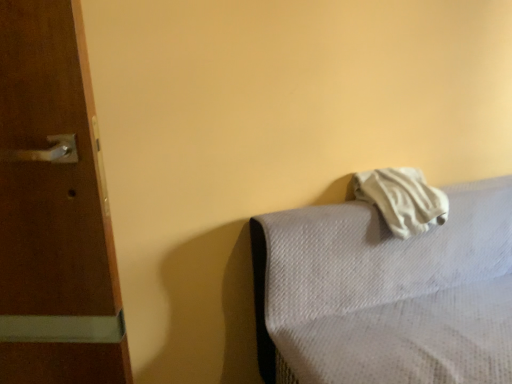
Question: Considering the relative sizes of white textured mattress at right and white soft towel at upper right in the image provided, is white textured mattress at right smaller than white soft towel at upper right?

Choices:
 (A) no
 (B) yes

Answer: (A)

Question: Is white textured mattress at right positioned with its back to white soft towel at upper right?

Choices:
 (A) no
 (B) yes

Answer: (B)

Question: Does white textured mattress at right have a greater width compared to white soft towel at upper right?

Choices:
 (A) no
 (B) yes

Answer: (B)

Question: Is white textured mattress at right surrounding white soft towel at upper right?

Choices:
 (A) no
 (B) yes

Answer: (B)

Question: From a real-world perspective, is white textured mattress at right under white soft towel at upper right?

Choices:
 (A) yes
 (B) no

Answer: (A)

Question: Does white textured mattress at right turn towards white soft towel at upper right?

Choices:
 (A) no
 (B) yes

Answer: (A)

Question: Would you say white soft towel at upper right is outside white textured mattress at right?

Choices:
 (A) no
 (B) yes

Answer: (A)

Question: Is white soft towel at upper right with white textured mattress at right?

Choices:
 (A) no
 (B) yes

Answer: (A)

Question: Considering the relative positions of white soft towel at upper right and white textured mattress at right in the image provided, is white soft towel at upper right in front of white textured mattress at right?

Choices:
 (A) no
 (B) yes

Answer: (A)

Question: Can you confirm if white soft towel at upper right is bigger than white textured mattress at right?

Choices:
 (A) no
 (B) yes

Answer: (A)

Question: Could white textured mattress at right be considered to be inside white soft towel at upper right?

Choices:
 (A) yes
 (B) no

Answer: (B)

Question: Is white soft towel at upper right to the right of white textured mattress at right from the viewer's perspective?

Choices:
 (A) yes
 (B) no

Answer: (B)

Question: Is white textured mattress at right bigger or smaller than white soft towel at upper right?

Choices:
 (A) big
 (B) small

Answer: (A)